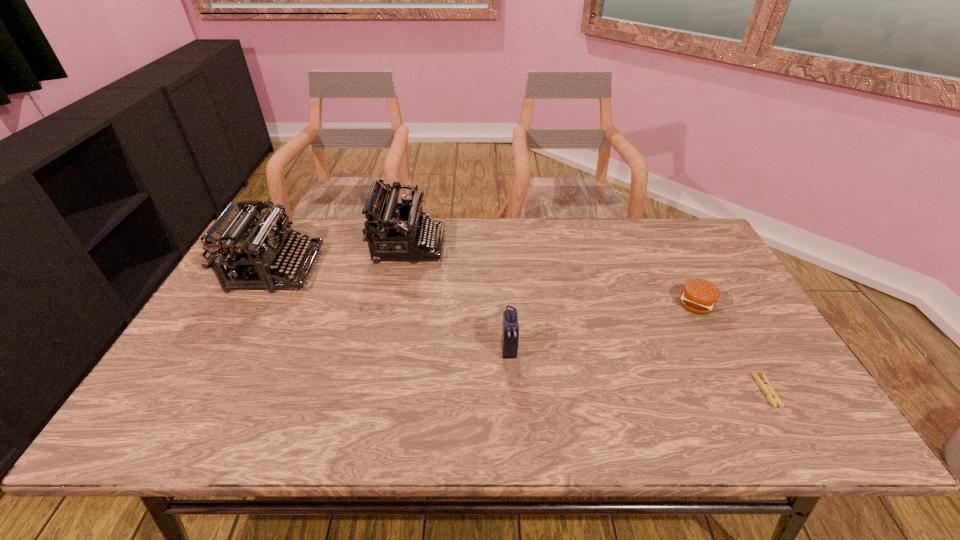
At what (x,y) coordinates should I click in order to perform the action: click on free space located on the left of the hamburger. Please return your answer as a coordinate pair (x, y). The image size is (960, 540). Looking at the image, I should click on [x=636, y=304].

This screenshot has width=960, height=540. In order to click on free space located on the back of the nearest object in this screenshot , I will do `click(743, 351)`.

You are a GUI agent. You are given a task and a screenshot of the screen. Output one action in this format:
    pyautogui.click(x=<x>, y=<y>)
    Task: Click on the object present at the near edge
    
    Given the screenshot: What is the action you would take?
    pyautogui.click(x=765, y=385)

At what (x,y) coordinates should I click in order to perform the action: click on object that is at the left edge. Please return your answer as a coordinate pair (x, y). This screenshot has width=960, height=540. Looking at the image, I should click on (238, 239).

Where is `hamburger at the right edge`? This screenshot has height=540, width=960. hamburger at the right edge is located at coordinates (699, 296).

This screenshot has height=540, width=960. I want to click on clothespin positioned at the right edge, so click(x=765, y=385).

At what (x,y) coordinates should I click in order to perform the action: click on object that is at the far left corner. Please return your answer as a coordinate pair (x, y). This screenshot has width=960, height=540. Looking at the image, I should click on (238, 239).

Identify the location of object located in the near right corner section of the desktop. (765, 385).

Find the location of `vacant space at the far edge`. vacant space at the far edge is located at coordinates (635, 236).

The image size is (960, 540). Identify the location of vacant space at the near edge of the desktop. (510, 406).